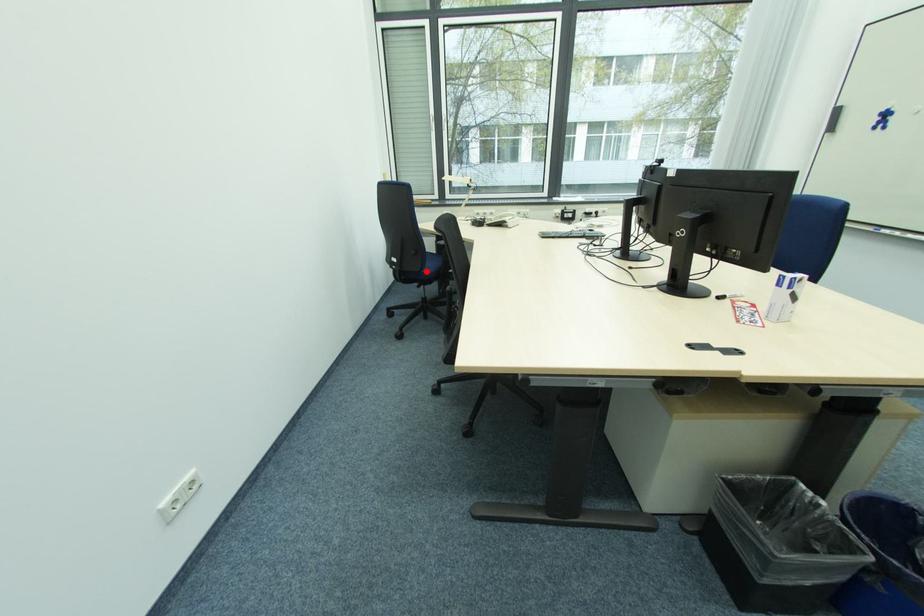
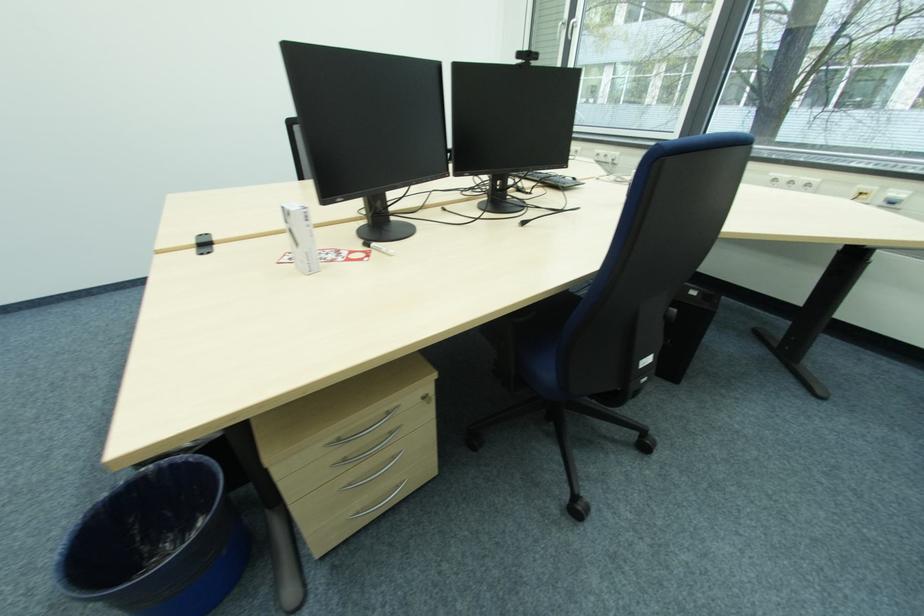
Question: I am providing you with two images of the same scene from different viewpoints. A red point is marked on the first image. At the location where the point appears in image 1, is it still visible in image 2?

Choices:
 (A) Yes
 (B) No

Answer: (B)